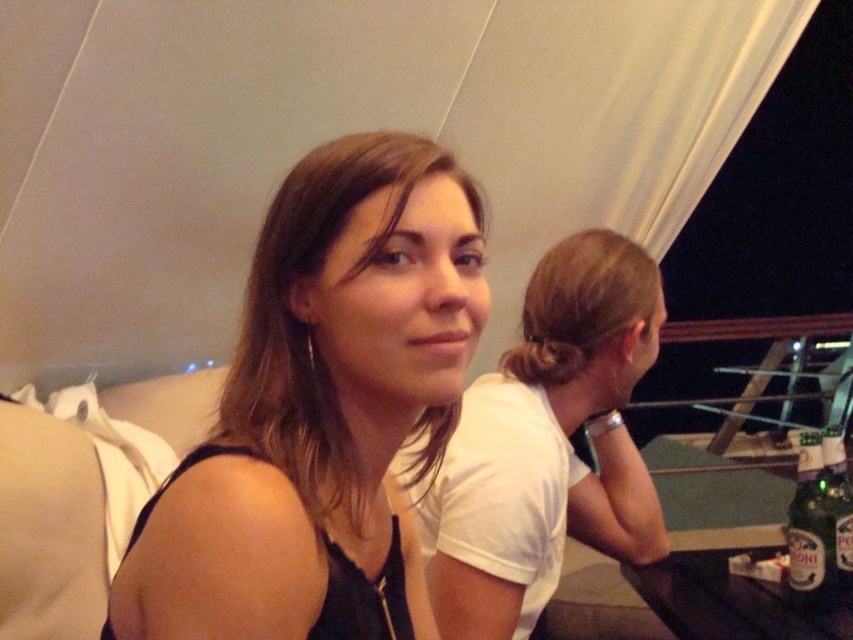
Does matte black hair at center have a lesser height compared to black plastic table at lower right?

In fact, matte black hair at center may be taller than black plastic table at lower right.

Between point (492, 396) and point (799, 627), which one is positioned in front?

Point (799, 627)

Is point (653, 323) more distant than point (706, 570)?

Yes, it is.

What are the coordinates of `matte black hair at center` in the screenshot? It's located at (547, 444).

Is translucent glass bottle at lower right positioned behind green glass bottle at lower right?

No, it is in front of green glass bottle at lower right.

Who is lower down, translucent glass bottle at lower right or green glass bottle at lower right?

translucent glass bottle at lower right is below.

This screenshot has height=640, width=853. Describe the element at coordinates (810, 529) in the screenshot. I see `translucent glass bottle at lower right` at that location.

The width and height of the screenshot is (853, 640). In order to click on translucent glass bottle at lower right in this screenshot , I will do `click(810, 529)`.

Is point (460, 451) behind point (792, 522)?

Yes, it is.

Can you confirm if matte black hair at center is thinner than translucent glass bottle at lower right?

In fact, matte black hair at center might be wider than translucent glass bottle at lower right.

Is point (490, 403) closer to camera compared to point (795, 522)?

No, (490, 403) is behind (795, 522).

You are a GUI agent. You are given a task and a screenshot of the screen. Output one action in this format:
    pyautogui.click(x=<x>, y=<y>)
    Task: Click on the matte black hair at center
    This screenshot has width=853, height=640.
    Given the screenshot: What is the action you would take?
    pyautogui.click(x=547, y=444)